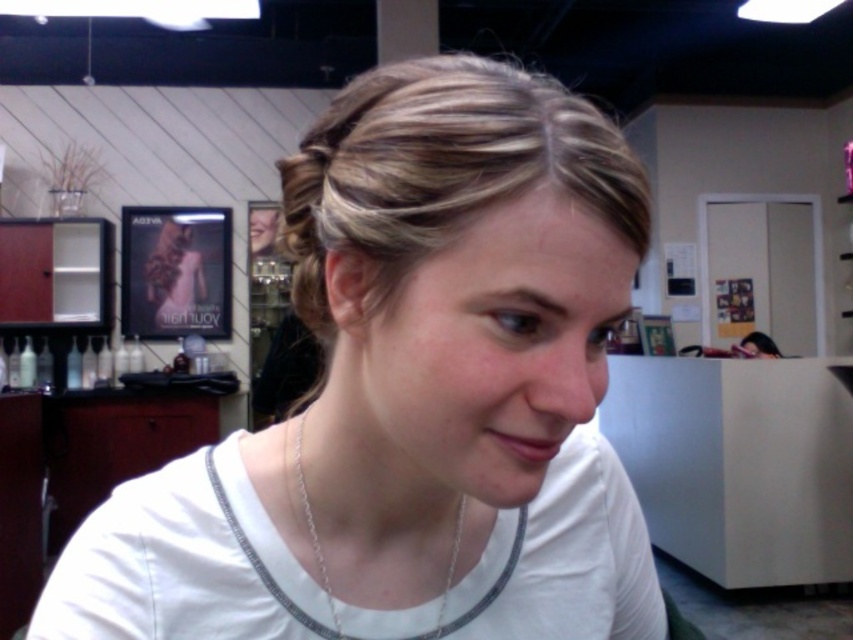
You are a stylist observing a client in a salon. You notice the white fabric shirt at center and the blonde smooth hair at center. Which item is positioned lower on the client?

The white fabric shirt at center is located below the blonde smooth hair at center, so the white fabric shirt at center is positioned lower on the client.

You are a stylist trying to choose accessories for a client. The client has blonde smooth hair at center and is wearing a silver chain necklace at lower center. Which accessory has a greater width?

The blonde smooth hair at center has a greater width than the silver chain necklace at lower center.

You are a stylist observing a client in a salon. You notice the white fabric shirt at center and the silver chain necklace at lower center. Which item is positioned higher on the client?

The white fabric shirt at center is positioned higher than the silver chain necklace at lower center, so the shirt is higher.